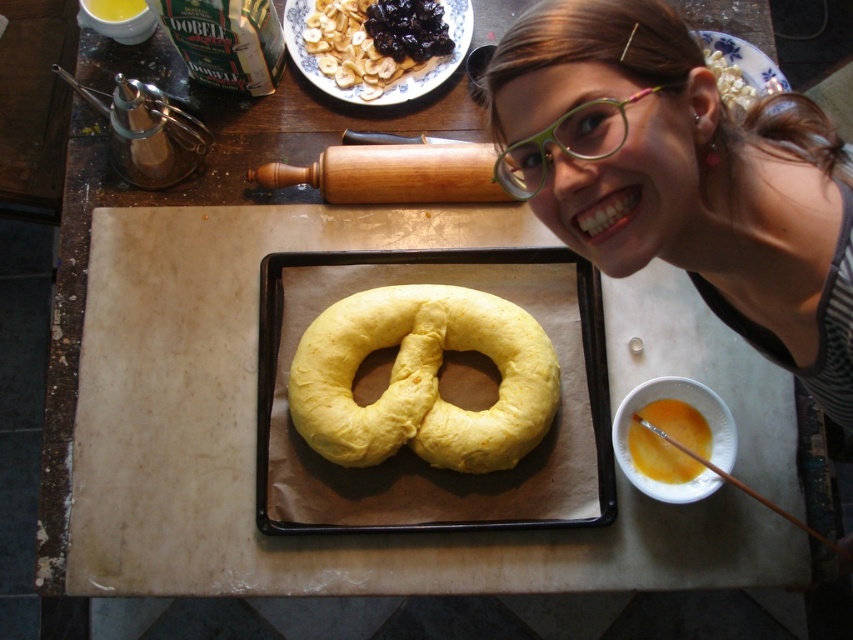
Where is `yellow doughnut at center`? The width and height of the screenshot is (853, 640). yellow doughnut at center is located at coordinates (422, 378).

Which is behind, point (537, 401) or point (331, 1)?

The point (331, 1) is more distant.

I want to click on yellow doughnut at center, so click(422, 378).

Image resolution: width=853 pixels, height=640 pixels. I want to click on yellow doughnut at center, so click(422, 378).

Who is more distant from viewer, (x=572, y=150) or (x=693, y=468)?

The point (x=693, y=468) is behind.

What do you see at coordinates (566, 141) in the screenshot? This screenshot has width=853, height=640. I see `green plastic glasses at upper center` at bounding box center [566, 141].

The image size is (853, 640). Describe the element at coordinates (566, 141) in the screenshot. I see `green plastic glasses at upper center` at that location.

Locate an element on the screen. green plastic glasses at upper center is located at coordinates (566, 141).

Which is more to the right, yellow doughnut at center or yellow matte egg yolk at center?

Positioned to the right is yellow matte egg yolk at center.

What do you see at coordinates (422, 378) in the screenshot?
I see `yellow doughnut at center` at bounding box center [422, 378].

At what (x,y) coordinates should I click in order to perform the action: click on yellow doughnut at center. Please return your answer as a coordinate pair (x, y). Image resolution: width=853 pixels, height=640 pixels. Looking at the image, I should click on (422, 378).